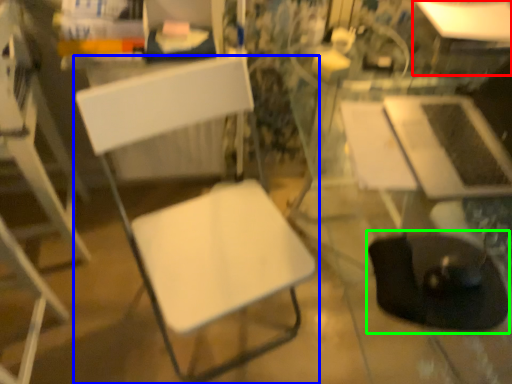
Question: Which object is positioned farthest from table (highlighted by a red box)? Select from chair (highlighted by a blue box) and swivel chair (highlighted by a green box).

Choices:
 (A) chair
 (B) swivel chair

Answer: (A)